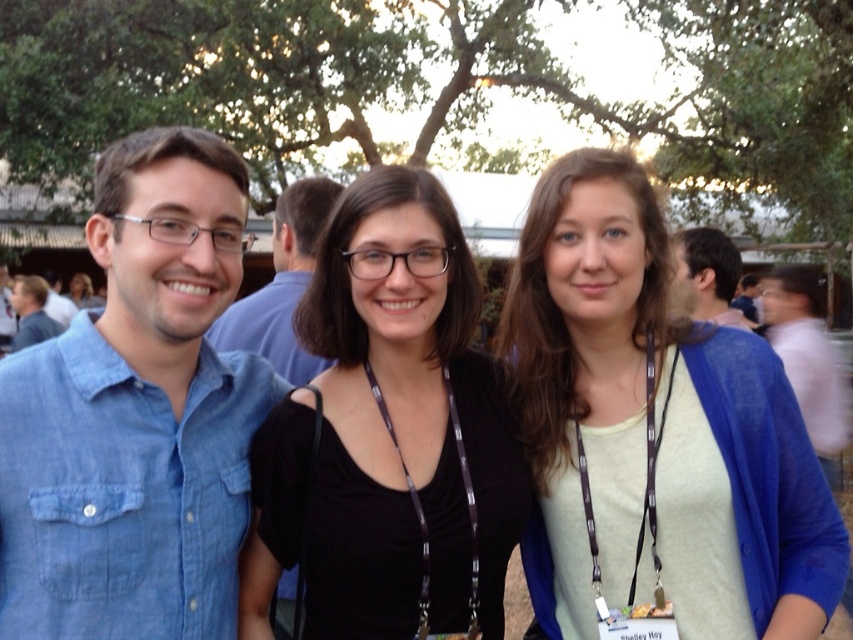
Is black matte shirt at center positioned behind pink fabric shirt at right?

No.

Can you confirm if black matte shirt at center is taller than pink fabric shirt at right?

Correct, black matte shirt at center is much taller as pink fabric shirt at right.

Between point (329, 499) and point (780, 328), which one is positioned in front?

Point (329, 499)

Find the location of a particular element. black matte shirt at center is located at coordinates (404, 420).

Is blue denim shirt at left above matte blue shirt at left?

Incorrect, blue denim shirt at left is not positioned above matte blue shirt at left.

Does blue denim shirt at left appear on the right side of matte blue shirt at left?

Yes, blue denim shirt at left is to the right of matte blue shirt at left.

Is point (229, 324) farther from viewer compared to point (25, 296)?

That is False.

Find the location of a particular element. blue denim shirt at left is located at coordinates (282, 284).

Does point (311, 180) come in front of point (798, 268)?

Yes, it is.

Can you confirm if blue denim shirt at left is bigger than pink fabric shirt at right?

Indeed, blue denim shirt at left has a larger size compared to pink fabric shirt at right.

Does point (306, 280) lie in front of point (769, 337)?

Yes, it is in front of point (769, 337).

What are the coordinates of `blue denim shirt at left` in the screenshot? It's located at (282, 284).